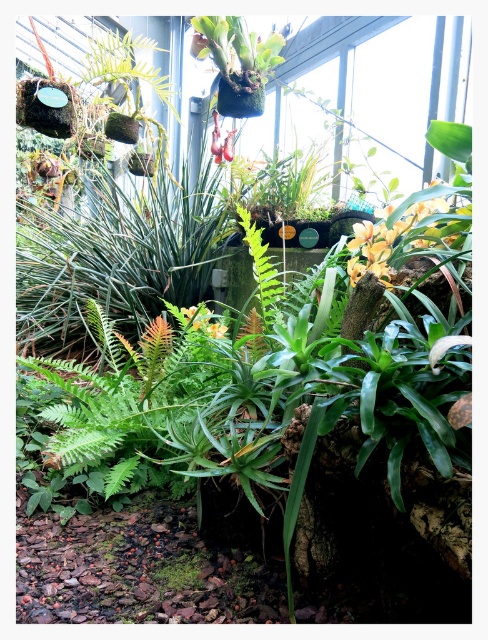
Question: Is the position of yellow-green textured flower at center-right more distant than that of yellow matte flower at center?

Choices:
 (A) no
 (B) yes

Answer: (A)

Question: Is yellow-green textured flower at center-right closer to the viewer compared to yellow matte flower at center?

Choices:
 (A) yes
 (B) no

Answer: (A)

Question: Among these points, which one is farthest from the camera?

Choices:
 (A) (192, 324)
 (B) (414, 211)

Answer: (A)

Question: Can you confirm if yellow-green textured flower at center-right is positioned to the left of yellow matte flower at center?

Choices:
 (A) yes
 (B) no

Answer: (B)

Question: Which point appears closest to the camera in this image?

Choices:
 (A) (403, 209)
 (B) (199, 314)

Answer: (A)